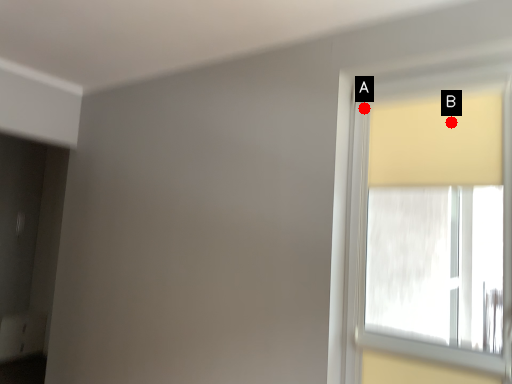
Question: Two points are circled on the image, labeled by A and B beside each circle. Which point is closer to the camera?

Choices:
 (A) A is closer
 (B) B is closer

Answer: (B)